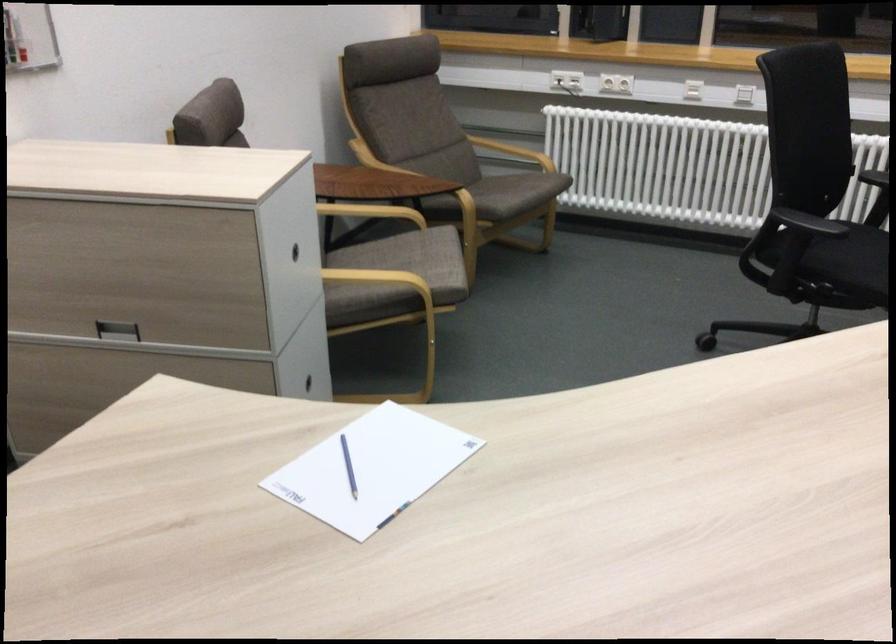
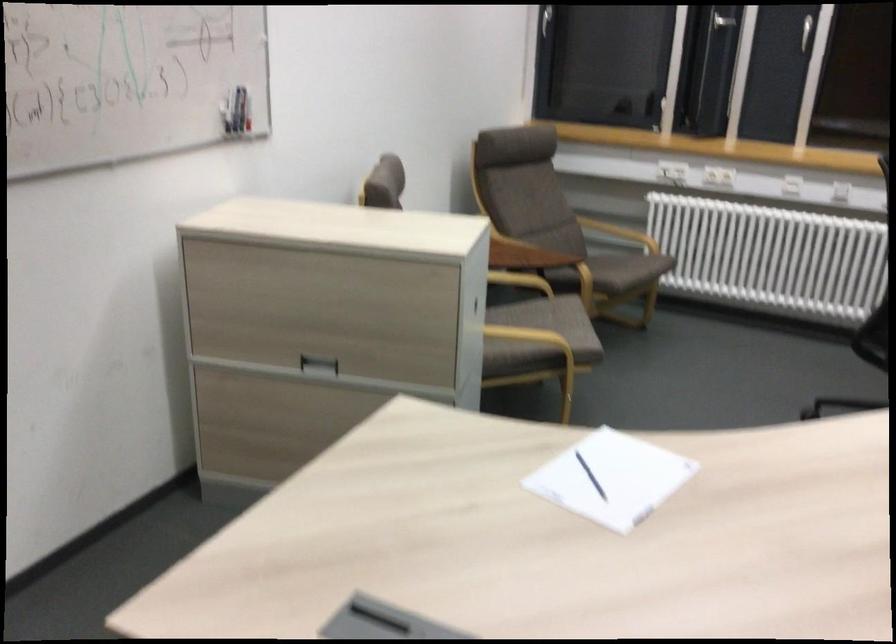
The point at (496, 198) is marked in the first image. Where is the corresponding point in the second image?

(618, 270)